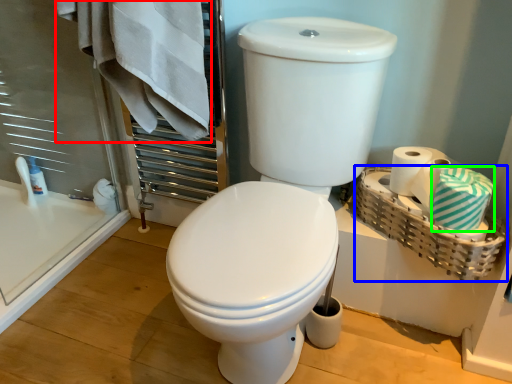
Question: Which object is positioned closest to bath towel (highlighted by a red box)? Select from basket (highlighted by a blue box) and bath towel (highlighted by a green box).

Choices:
 (A) basket
 (B) bath towel

Answer: (A)